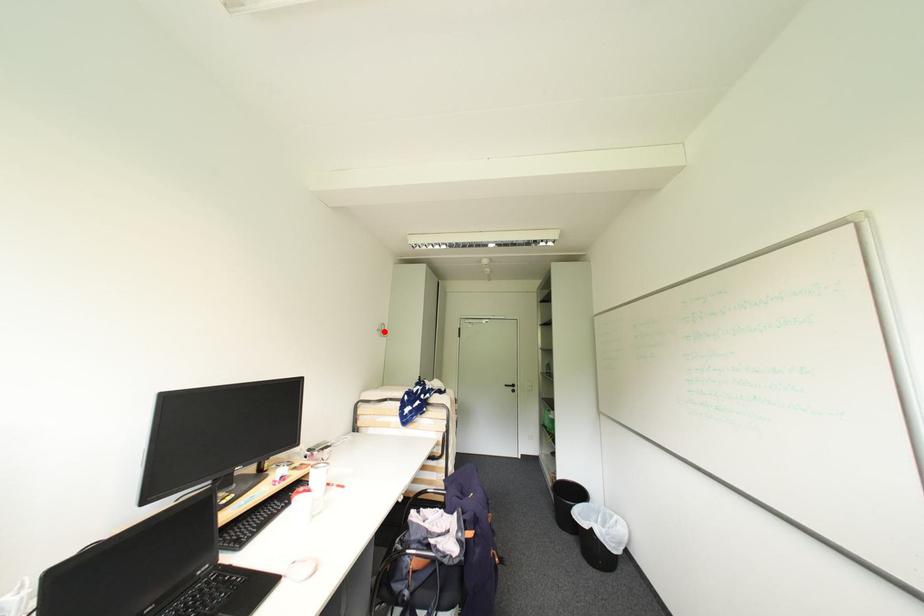
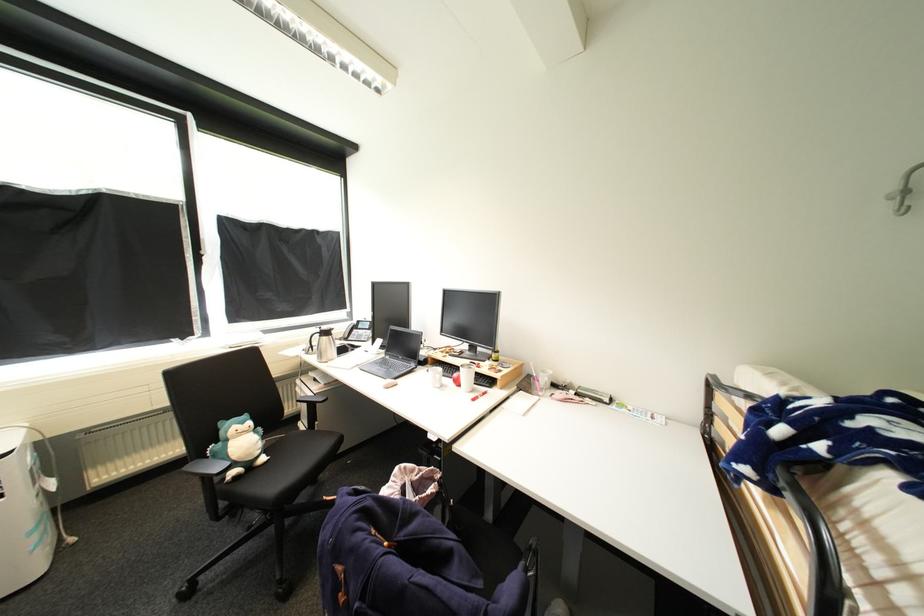
Locate, in the second image, the point that corresponds to the highlighted location in the first image.

(900, 199)